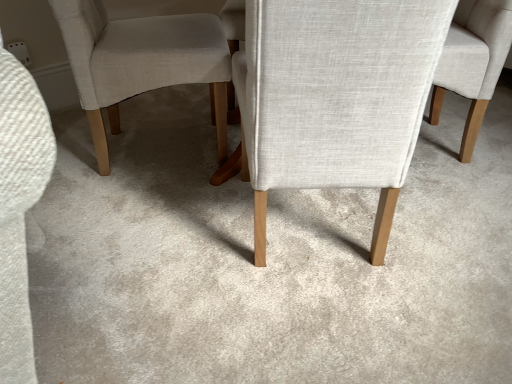
Question: Is light beige fabric chair at center, the first chair viewed from the right, completely or partially inside light beige fabric chair at center, which is counted as the 2th chair, starting from the right?

Choices:
 (A) yes
 (B) no

Answer: (B)

Question: Is light beige fabric chair at center, which is counted as the 2th chair, starting from the right, smaller than light beige fabric chair at center, the first chair viewed from the right?

Choices:
 (A) yes
 (B) no

Answer: (B)

Question: Is light beige fabric chair at center, positioned as the first chair in left-to-right order, next to light beige fabric chair at center, the first chair viewed from the right?

Choices:
 (A) yes
 (B) no

Answer: (B)

Question: Considering the relative sizes of light beige fabric chair at center, which is counted as the 2th chair, starting from the right, and light beige fabric chair at center, the 2th chair from the left, in the image provided, is light beige fabric chair at center, which is counted as the 2th chair, starting from the right, taller than light beige fabric chair at center, the 2th chair from the left,?

Choices:
 (A) yes
 (B) no

Answer: (A)

Question: Is light beige fabric chair at center, which is counted as the 2th chair, starting from the right, positioned with its back to light beige fabric chair at center, the first chair viewed from the right?

Choices:
 (A) yes
 (B) no

Answer: (B)

Question: From the image's perspective, would you say light beige fabric chair at center, which is counted as the 2th chair, starting from the right, is positioned over light beige fabric chair at center, the 2th chair from the left?

Choices:
 (A) yes
 (B) no

Answer: (B)

Question: Does light beige fabric chair at center, the 2th chair from the left, lie behind light beige fabric chair at center, which is counted as the 2th chair, starting from the right?

Choices:
 (A) yes
 (B) no

Answer: (A)

Question: Considering the relative sizes of light beige fabric chair at center, the first chair viewed from the right, and light beige fabric chair at center, which is counted as the 2th chair, starting from the right, in the image provided, is light beige fabric chair at center, the first chair viewed from the right, thinner than light beige fabric chair at center, which is counted as the 2th chair, starting from the right,?

Choices:
 (A) no
 (B) yes

Answer: (B)

Question: Can you confirm if light beige fabric chair at center, the first chair viewed from the right, is smaller than light beige fabric chair at center, which is counted as the 2th chair, starting from the right?

Choices:
 (A) yes
 (B) no

Answer: (A)

Question: Does light beige fabric chair at center, the 2th chair from the left, have a greater width compared to light beige fabric chair at center, positioned as the first chair in left-to-right order?

Choices:
 (A) no
 (B) yes

Answer: (A)

Question: Can you confirm if light beige fabric chair at center, the first chair viewed from the right, is shorter than light beige fabric chair at center, which is counted as the 2th chair, starting from the right?

Choices:
 (A) yes
 (B) no

Answer: (A)

Question: Considering the relative positions of light beige fabric chair at center, the 2th chair from the left, and light beige fabric chair at center, which is counted as the 2th chair, starting from the right, in the image provided, is light beige fabric chair at center, the 2th chair from the left, to the left of light beige fabric chair at center, which is counted as the 2th chair, starting from the right, from the viewer's perspective?

Choices:
 (A) yes
 (B) no

Answer: (B)

Question: Is light beige fabric chair at center, the 2th chair from the left, situated inside light beige fabric chair at center, which is counted as the 2th chair, starting from the right, or outside?

Choices:
 (A) outside
 (B) inside

Answer: (A)